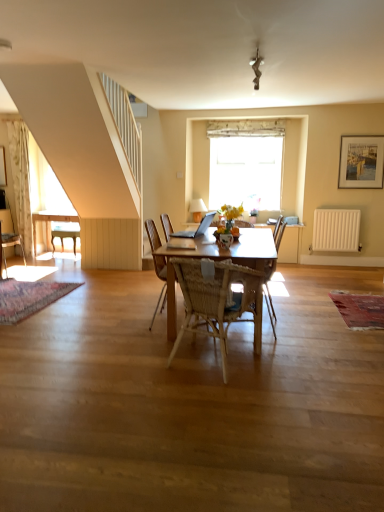
This screenshot has height=512, width=384. In order to click on vacant area located to the right-hand side of woven wood chair at center, which ranks as the first chair in front-to-back order in this screenshot , I will do `click(311, 364)`.